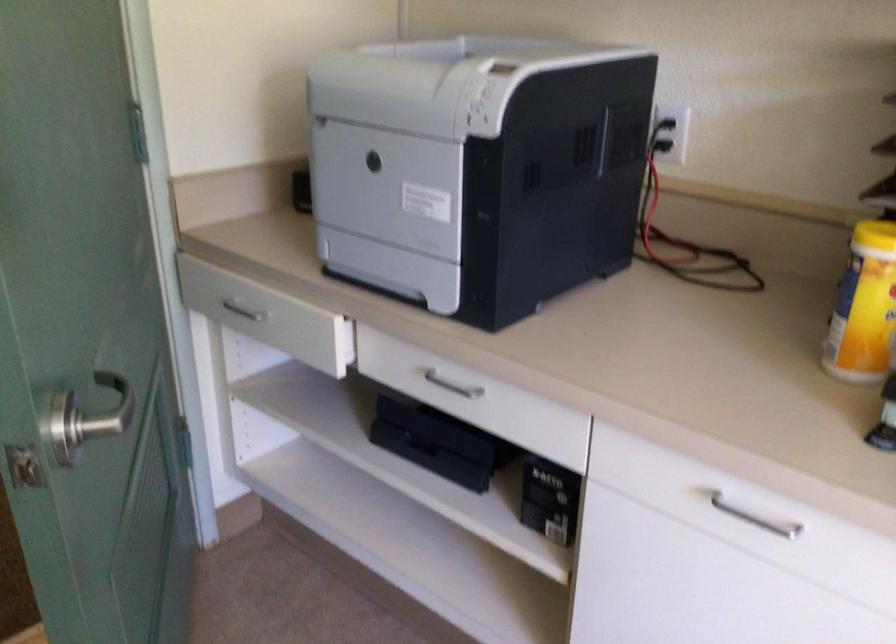
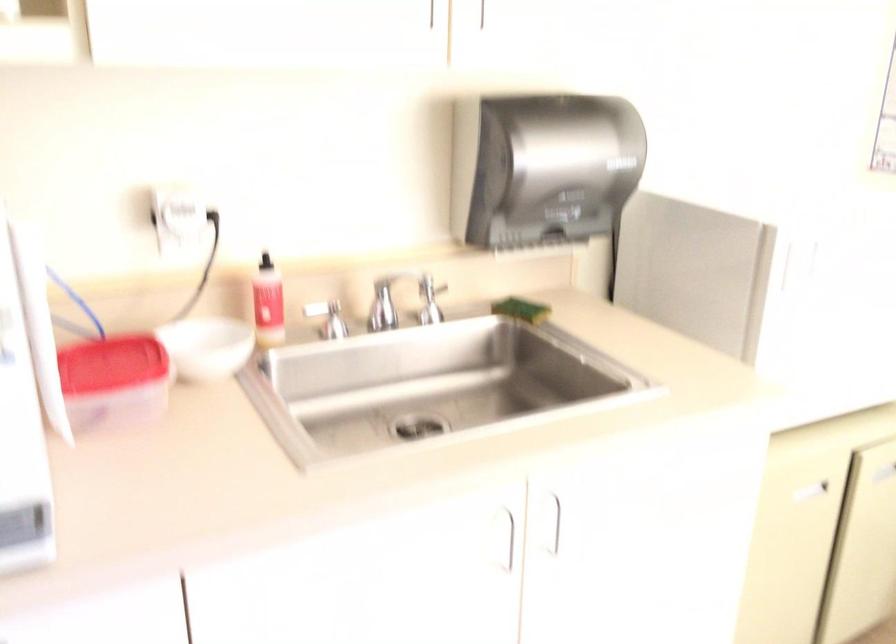
Question: The camera is either moving clockwise (left) or counter-clockwise (right) around the object. The first image is from the beginning of the video and the second image is from the end. Is the camera moving left or right when shooting the video?

Choices:
 (A) Left
 (B) Right

Answer: (A)